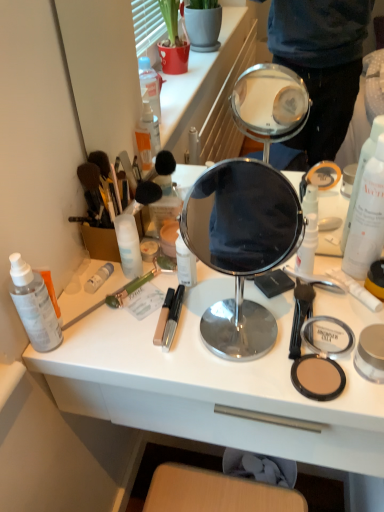
Image resolution: width=384 pixels, height=512 pixels. I want to click on free area in between transparent plastic spray bottle at left, which is the 6th toiletry in right-to-left order, and white matte spray bottle at right, so click(201, 309).